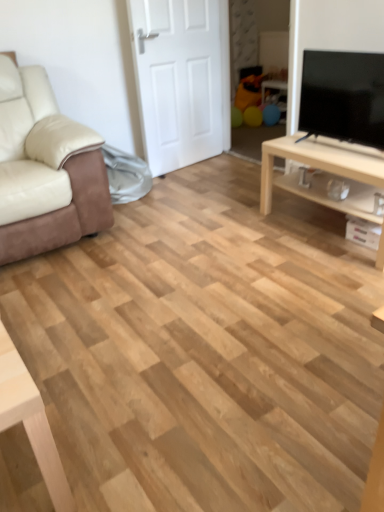
In order to click on vacant area situated below white matte door at center (from a real-world perspective) in this screenshot , I will do `click(196, 162)`.